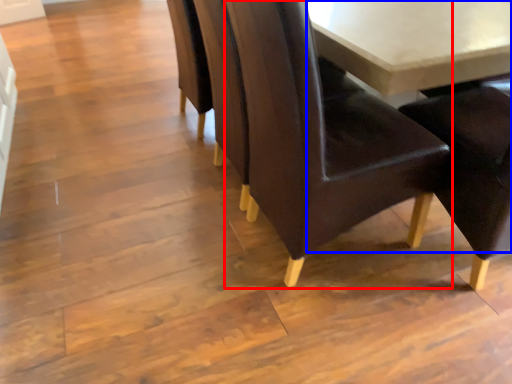
Question: Which point is closer to the camera, chair (highlighted by a red box) or table (highlighted by a blue box)?

Choices:
 (A) chair
 (B) table

Answer: (A)